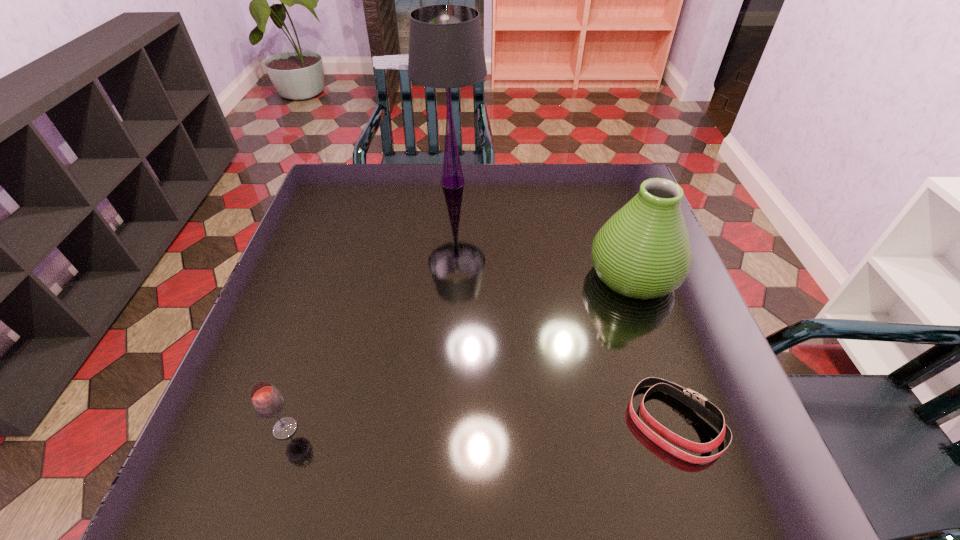
You are a GUI agent. You are given a task and a screenshot of the screen. Output one action in this format:
    pyautogui.click(x=<x>, y=<y>)
    Task: Click on the lampshade
    
    Given the screenshot: What is the action you would take?
    pyautogui.click(x=446, y=50)

You are a GUI agent. You are given a task and a screenshot of the screen. Output one action in this format:
    pyautogui.click(x=<x>, y=<y>)
    Task: Click on the tallest object
    This screenshot has height=540, width=960.
    Given the screenshot: What is the action you would take?
    pyautogui.click(x=446, y=50)

Locate an element on the screen. This screenshot has height=540, width=960. vase is located at coordinates (643, 251).

This screenshot has width=960, height=540. In order to click on the second farthest object in this screenshot , I will do `click(643, 251)`.

Locate an element on the screen. The height and width of the screenshot is (540, 960). the second shortest object is located at coordinates (267, 401).

Find the location of `the leftmost object`. the leftmost object is located at coordinates (267, 401).

This screenshot has width=960, height=540. What are the coordinates of `dog collar` in the screenshot? It's located at (695, 401).

This screenshot has height=540, width=960. Identify the location of vacant space located on the front-facing side of the third object from right to left. (528, 182).

I want to click on free space located 0.050m on the front of the vase, so click(652, 327).

What are the coordinates of `free spot located on the right of the leftmost object` in the screenshot? It's located at (473, 429).